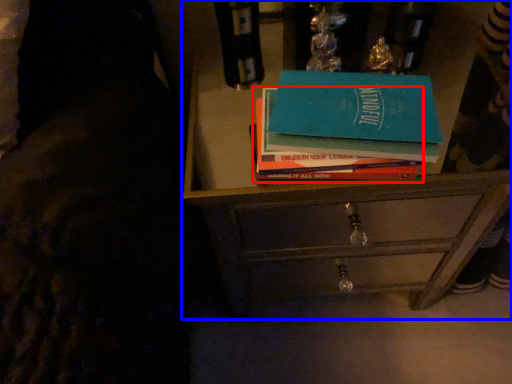
Question: Among these objects, which one is nearest to the camera, book (highlighted by a red box) or chest of drawers (highlighted by a blue box)?

Choices:
 (A) book
 (B) chest of drawers

Answer: (A)